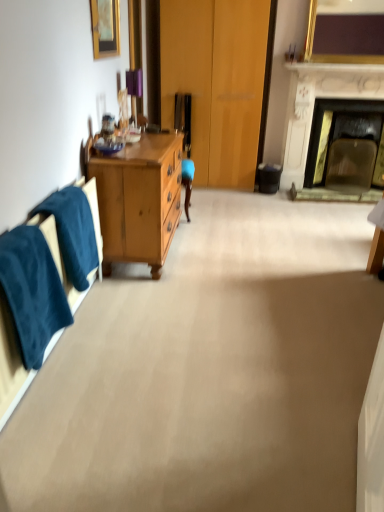
Question: Is black plastic trash can at lower right looking in the opposite direction of velvety blue towel at left, the first towel/napkin when ordered from front to back?

Choices:
 (A) yes
 (B) no

Answer: (B)

Question: Is black plastic trash can at lower right touching velvety blue towel at left, the 2th towel/napkin viewed from the back?

Choices:
 (A) no
 (B) yes

Answer: (A)

Question: Is black plastic trash can at lower right shorter than velvety blue towel at left, the 2th towel/napkin viewed from the back?

Choices:
 (A) no
 (B) yes

Answer: (B)

Question: Is the position of black plastic trash can at lower right more distant than that of velvety blue towel at left, the 2th towel/napkin viewed from the back?

Choices:
 (A) yes
 (B) no

Answer: (A)

Question: From the image's perspective, does black plastic trash can at lower right appear higher than velvety blue towel at left, the first towel/napkin when ordered from front to back?

Choices:
 (A) no
 (B) yes

Answer: (B)

Question: Looking at their shapes, would you say blue fabric towel at left, the second towel/napkin positioned from the front, is wider or thinner than gold-framed picture at upper left, the 1th picture frame from the left?

Choices:
 (A) wide
 (B) thin

Answer: (A)

Question: From the image's perspective, is blue fabric towel at left, the first towel/napkin positioned from the back, above or below gold-framed picture at upper left, marked as the second picture frame in a top-to-bottom arrangement?

Choices:
 (A) above
 (B) below

Answer: (B)

Question: From a real-world perspective, is blue fabric towel at left, the first towel/napkin positioned from the back, positioned above or below gold-framed picture at upper left, which is counted as the 1th picture frame, starting from the front?

Choices:
 (A) below
 (B) above

Answer: (A)

Question: Based on their sizes in the image, would you say blue fabric towel at left, the second towel/napkin positioned from the front, is bigger or smaller than gold-framed picture at upper left, the first picture frame from the bottom?

Choices:
 (A) small
 (B) big

Answer: (B)

Question: In the image, is black plastic trash can at lower right positioned in front of or behind velvety blue towel at left, the first towel/napkin when ordered from front to back?

Choices:
 (A) behind
 (B) front

Answer: (A)

Question: Based on their positions, is black plastic trash can at lower right located to the left or right of velvety blue towel at left, the first towel/napkin when ordered from front to back?

Choices:
 (A) right
 (B) left

Answer: (A)

Question: Choose the correct answer: Is black plastic trash can at lower right inside velvety blue towel at left, the 2th towel/napkin viewed from the back, or outside it?

Choices:
 (A) inside
 (B) outside

Answer: (B)

Question: From a real-world perspective, relative to velvety blue towel at left, the 2th towel/napkin viewed from the back, is black plastic trash can at lower right vertically above or below?

Choices:
 (A) below
 (B) above

Answer: (A)

Question: Is gold-framed picture at upper left, the 1th picture frame from the left, in front of or behind gold metallic picture frame at upper right, the second picture frame in the left-to-right sequence, in the image?

Choices:
 (A) behind
 (B) front

Answer: (B)

Question: Is point tap(102, 36) closer or farther from the camera than point tap(347, 19)?

Choices:
 (A) farther
 (B) closer

Answer: (B)